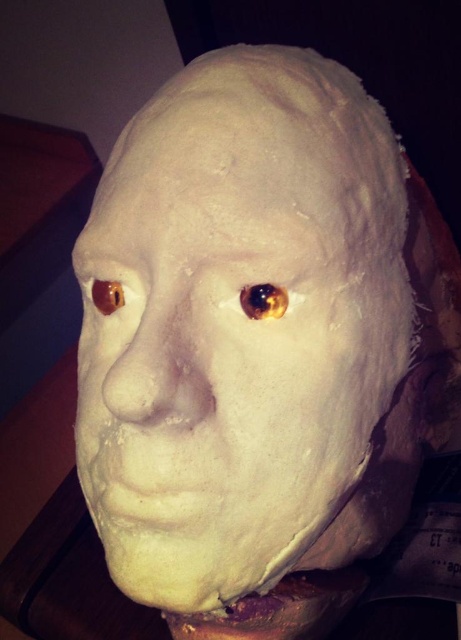
Question: Is matte white nose at center positioned before shiny amber eye at center?

Choices:
 (A) no
 (B) yes

Answer: (B)

Question: Which point appears closest to the camera in this image?

Choices:
 (A) (254, 301)
 (B) (139, 420)

Answer: (B)

Question: Which object appears farthest from the camera in this image?

Choices:
 (A) matte white nose at center
 (B) shiny amber eye at center

Answer: (B)

Question: Does matte white nose at center appear under translucent amber eye at upper left?

Choices:
 (A) yes
 (B) no

Answer: (A)

Question: Is matte white nose at center above shiny amber eye at center?

Choices:
 (A) yes
 (B) no

Answer: (B)

Question: Which object is positioned farthest from the matte white nose at center?

Choices:
 (A) translucent amber eye at upper left
 (B) shiny amber eye at center

Answer: (A)